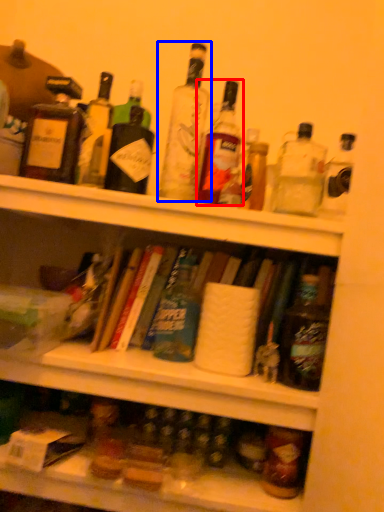
Question: Which point is closer to the camera, bottle (highlighted by a red box) or bottle (highlighted by a blue box)?

Choices:
 (A) bottle
 (B) bottle

Answer: (B)